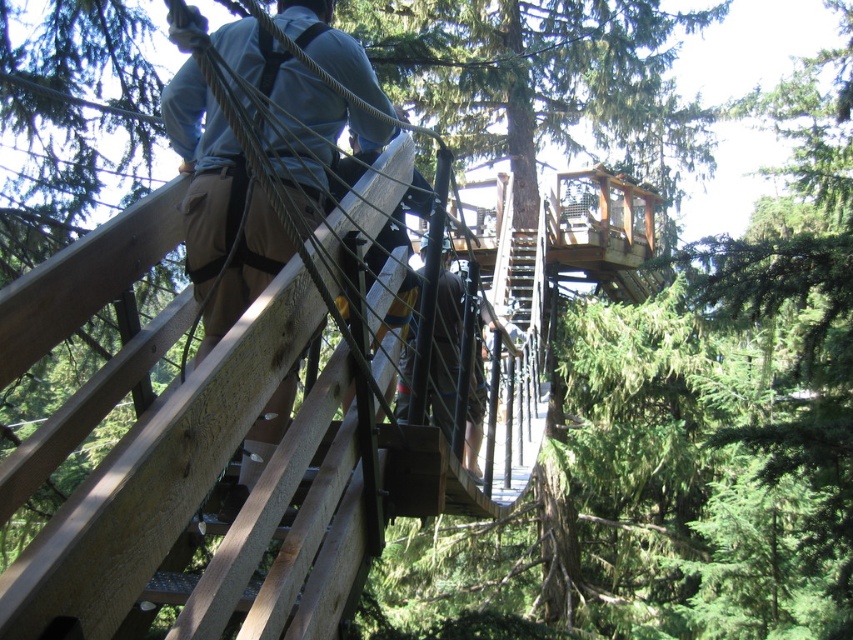
Is brown leather pants at upper left to the left of brown leather pants at center from the viewer's perspective?

Indeed, brown leather pants at upper left is positioned on the left side of brown leather pants at center.

Image resolution: width=853 pixels, height=640 pixels. In order to click on brown leather pants at upper left in this screenshot , I will do `click(244, 164)`.